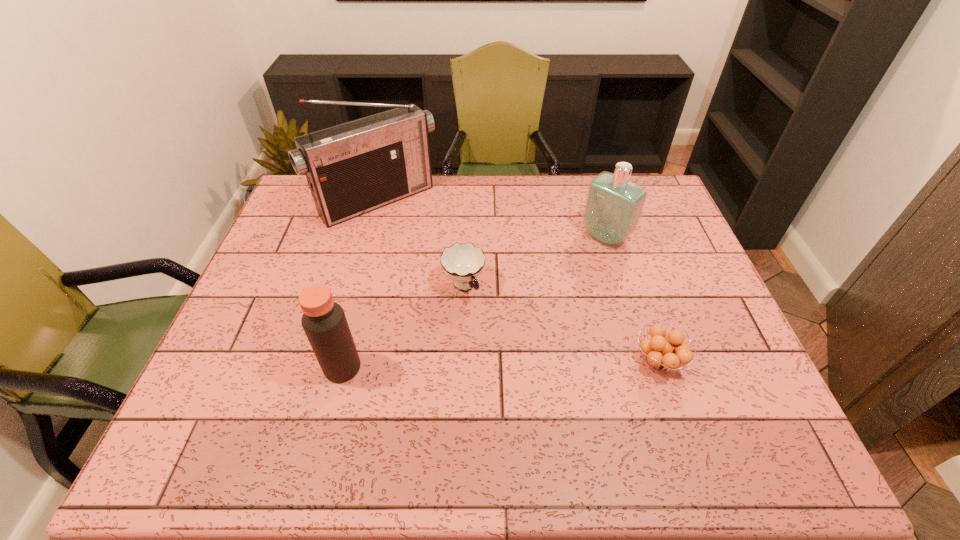
Identify the location of object that is at the left edge. (353, 168).

Locate an element on the screen. The width and height of the screenshot is (960, 540). object that is at the right edge is located at coordinates (659, 351).

Identify the location of object that is at the far left corner. The image size is (960, 540). (353, 168).

Find the location of `object present at the near right corner`. object present at the near right corner is located at coordinates (659, 351).

I want to click on vacant area at the far edge, so click(583, 188).

This screenshot has height=540, width=960. Identify the location of blank space at the near edge. (684, 394).

You are a GUI agent. You are given a task and a screenshot of the screen. Output one action in this format:
    pyautogui.click(x=<x>, y=<y>)
    Task: Click on the vacant space at the left edge
    The height and width of the screenshot is (540, 960).
    Given the screenshot: What is the action you would take?
    pyautogui.click(x=276, y=237)

The image size is (960, 540). I want to click on free space at the right edge of the desktop, so click(707, 320).

Identify the location of vacant space that is in between the perfume and the tallest object. (492, 219).

At what (x,y) coordinates should I click in order to perform the action: click on unoccupied area between the orange fruit and the vinegar. Please return your answer as a coordinate pair (x, y). This screenshot has height=540, width=960. Looking at the image, I should click on (500, 364).